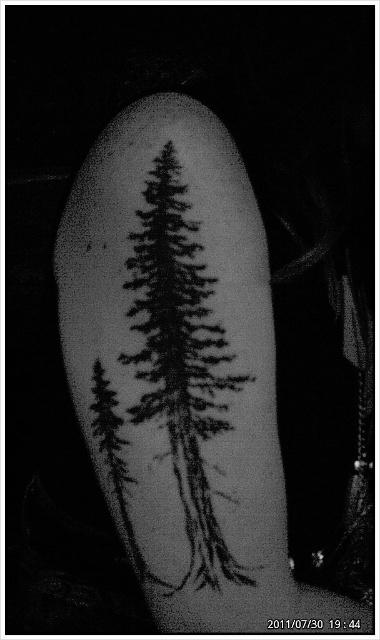
Can you confirm if black ink tattoo at center is positioned above black ink tree at center?

Yes, black ink tattoo at center is above black ink tree at center.

Can you confirm if black ink tattoo at center is taller than black ink tree at center?

Indeed, black ink tattoo at center has a greater height compared to black ink tree at center.

Which is in front, point (180, 458) or point (171, 241)?

Positioned in front is point (180, 458).

This screenshot has height=640, width=380. What are the coordinates of `black ink tattoo at center` in the screenshot? It's located at click(182, 371).